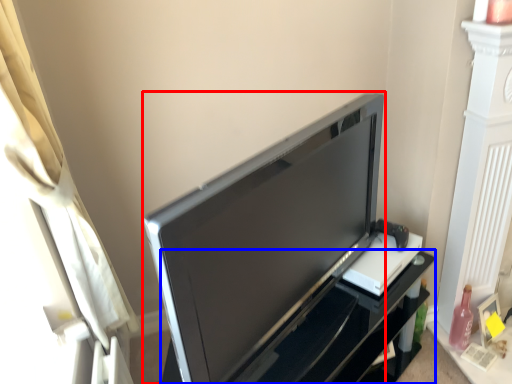
Question: Which object appears farthest to the camera in this image, television (highlighted by a red box) or furniture (highlighted by a blue box)?

Choices:
 (A) television
 (B) furniture

Answer: (B)